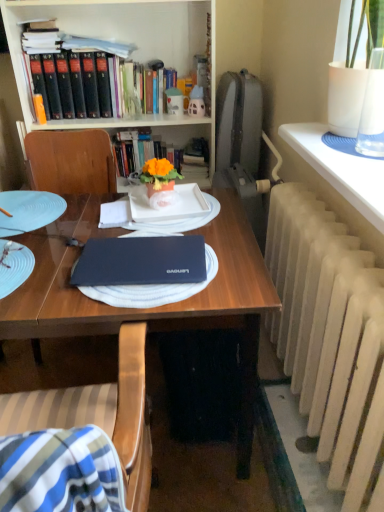
The width and height of the screenshot is (384, 512). Find the location of `free space above blue matte glass plate at left (from a real-world perspective)`. free space above blue matte glass plate at left (from a real-world perspective) is located at coordinates (21, 210).